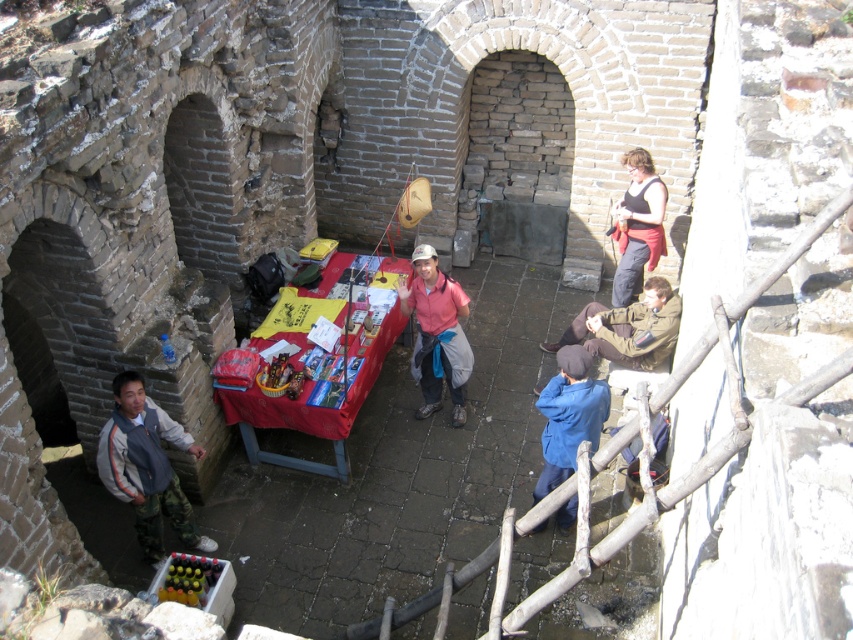
Question: Is matte pink shirt at center to the right of black fabric vest at upper right from the viewer's perspective?

Choices:
 (A) no
 (B) yes

Answer: (A)

Question: Which point is closer to the camera?

Choices:
 (A) (434, 390)
 (B) (653, 230)

Answer: (A)

Question: Which object appears farthest from the camera in this image?

Choices:
 (A) camouflage pants at lower left
 (B) black fabric vest at upper right
 (C) camouflage pants at lower right

Answer: (B)

Question: Which object is farther from the camera taking this photo?

Choices:
 (A) blue fabric jacket at lower right
 (B) black fabric vest at upper right

Answer: (B)

Question: Does camouflage pants at lower left appear on the right side of blue fabric jacket at lower right?

Choices:
 (A) yes
 (B) no

Answer: (B)

Question: Does matte pink shirt at center have a larger size compared to blue fabric jacket at lower right?

Choices:
 (A) yes
 (B) no

Answer: (A)